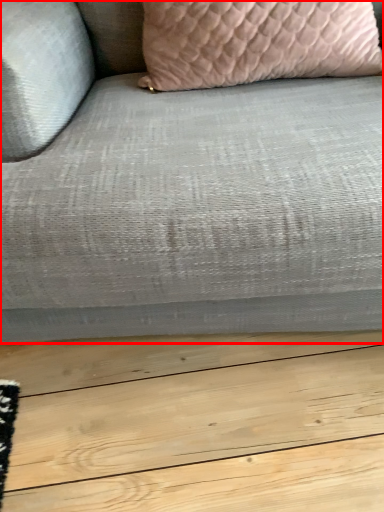
Question: From the image's perspective, what is the correct spatial relationship of studio couch (annotated by the red box) in relation to pillow?

Choices:
 (A) below
 (B) above

Answer: (A)